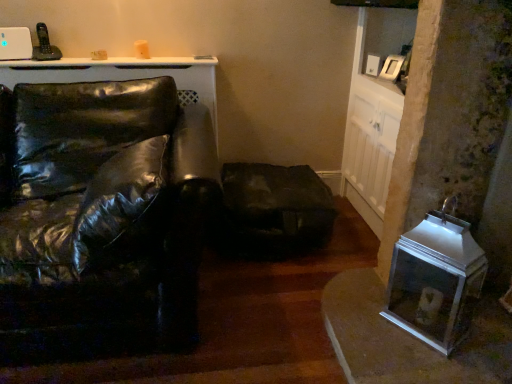
Question: Is glossy black leather couch at left outside of metallic silver pet carrier at lower right?

Choices:
 (A) yes
 (B) no

Answer: (A)

Question: Is metallic silver pet carrier at lower right completely or partially inside glossy black leather couch at left?

Choices:
 (A) yes
 (B) no

Answer: (B)

Question: Is glossy black leather couch at left to the left of metallic silver pet carrier at lower right from the viewer's perspective?

Choices:
 (A) yes
 (B) no

Answer: (A)

Question: Is glossy black leather couch at left bigger than metallic silver pet carrier at lower right?

Choices:
 (A) yes
 (B) no

Answer: (A)

Question: From the image's perspective, is glossy black leather couch at left beneath metallic silver pet carrier at lower right?

Choices:
 (A) no
 (B) yes

Answer: (A)

Question: Is glossy black leather couch at left bigger or smaller than dark brown leather swivel chair at center?

Choices:
 (A) small
 (B) big

Answer: (B)

Question: From a real-world perspective, is glossy black leather couch at left positioned above or below dark brown leather swivel chair at center?

Choices:
 (A) above
 (B) below

Answer: (A)

Question: Is glossy black leather couch at left to the left or to the right of dark brown leather swivel chair at center in the image?

Choices:
 (A) right
 (B) left

Answer: (B)

Question: From the image's perspective, is glossy black leather couch at left above or below dark brown leather swivel chair at center?

Choices:
 (A) below
 (B) above

Answer: (B)

Question: From a real-world perspective, relative to metallic silver pet carrier at lower right, is dark brown leather swivel chair at center vertically above or below?

Choices:
 (A) below
 (B) above

Answer: (A)

Question: Is point (320, 235) closer or farther from the camera than point (430, 279)?

Choices:
 (A) closer
 (B) farther

Answer: (B)

Question: Considering their positions, is dark brown leather swivel chair at center located in front of or behind metallic silver pet carrier at lower right?

Choices:
 (A) behind
 (B) front

Answer: (A)

Question: Considering the relative positions of dark brown leather swivel chair at center and metallic silver pet carrier at lower right in the image provided, is dark brown leather swivel chair at center to the left or to the right of metallic silver pet carrier at lower right?

Choices:
 (A) left
 (B) right

Answer: (A)

Question: Would you say dark brown leather swivel chair at center is inside or outside glossy black leather couch at left?

Choices:
 (A) outside
 (B) inside

Answer: (A)

Question: Considering the positions of dark brown leather swivel chair at center and glossy black leather couch at left in the image, is dark brown leather swivel chair at center taller or shorter than glossy black leather couch at left?

Choices:
 (A) short
 (B) tall

Answer: (A)